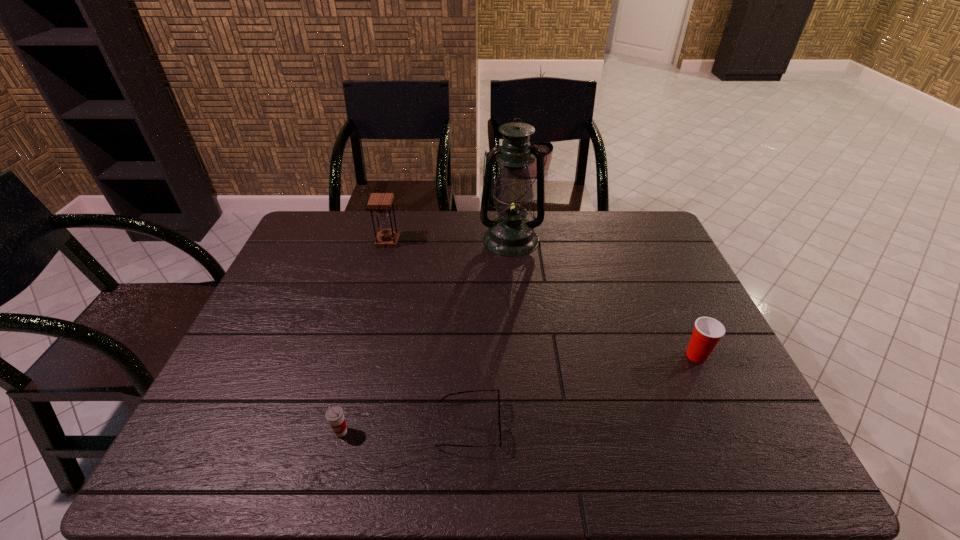
I want to click on oil lamp, so click(x=511, y=234).

What are the coordinates of `the fourth shortest object` in the screenshot? It's located at (381, 202).

The image size is (960, 540). In order to click on the rightmost object in this screenshot , I will do `click(708, 331)`.

Locate an element on the screen. This screenshot has width=960, height=540. Dixie cup is located at coordinates (708, 331).

You are a GUI agent. You are given a task and a screenshot of the screen. Output one action in this format:
    pyautogui.click(x=<x>, y=<y>)
    Task: Click on the cup
    The width and height of the screenshot is (960, 540).
    Given the screenshot: What is the action you would take?
    pyautogui.click(x=335, y=416)

Where is `the shortest object`? The width and height of the screenshot is (960, 540). the shortest object is located at coordinates (499, 422).

The height and width of the screenshot is (540, 960). I want to click on free spot located 0.390m on the front of the tallest object, so click(521, 350).

The image size is (960, 540). Find the location of `vacant space located 0.130m on the right of the hourglass`. vacant space located 0.130m on the right of the hourglass is located at coordinates (437, 241).

In order to click on free space located 0.290m on the back of the Dixie cup in this screenshot , I will do `click(658, 273)`.

Identify the location of vacant position located 0.070m on the side of the cup with the logo. This screenshot has height=540, width=960. (331, 472).